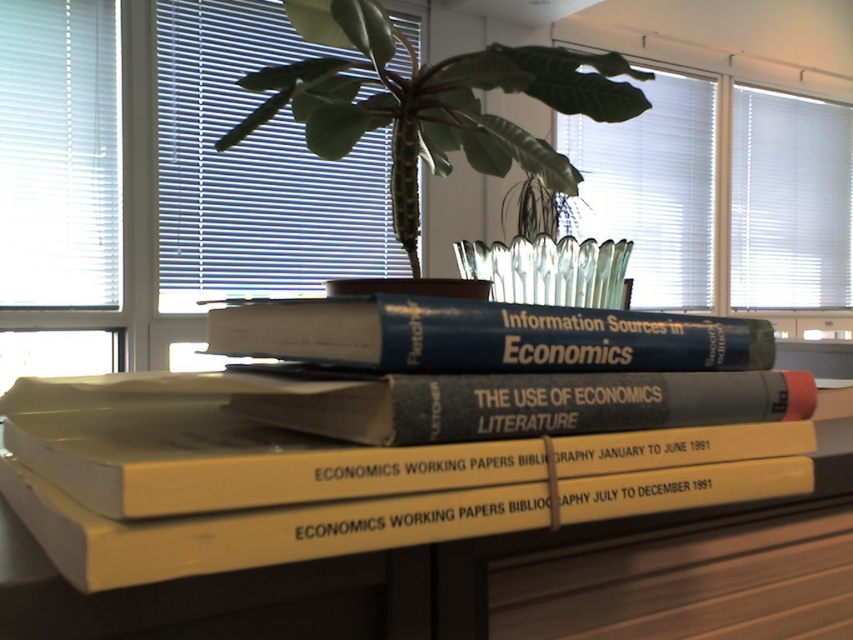
Which is in front, point (366, 252) or point (734, 230)?

Point (366, 252)

This screenshot has height=640, width=853. Describe the element at coordinates (254, 168) in the screenshot. I see `white plastic blinds at upper left` at that location.

This screenshot has height=640, width=853. What are the coordinates of `white plastic blinds at upper left` in the screenshot? It's located at (254, 168).

Based on the photo, between transparent glass window at upper center and yellow matte book at center, which one is positioned lower?

yellow matte book at center is lower down.

Between transparent glass window at upper center and yellow matte book at center, which one is positioned higher?

transparent glass window at upper center is above.

Identify the location of transparent glass window at upper center. (161, 182).

Does transparent glass window at upper center lie behind white plastic blinds at upper right?

That is False.

Where is `transparent glass window at upper center`? Image resolution: width=853 pixels, height=640 pixels. transparent glass window at upper center is located at coordinates (161, 182).